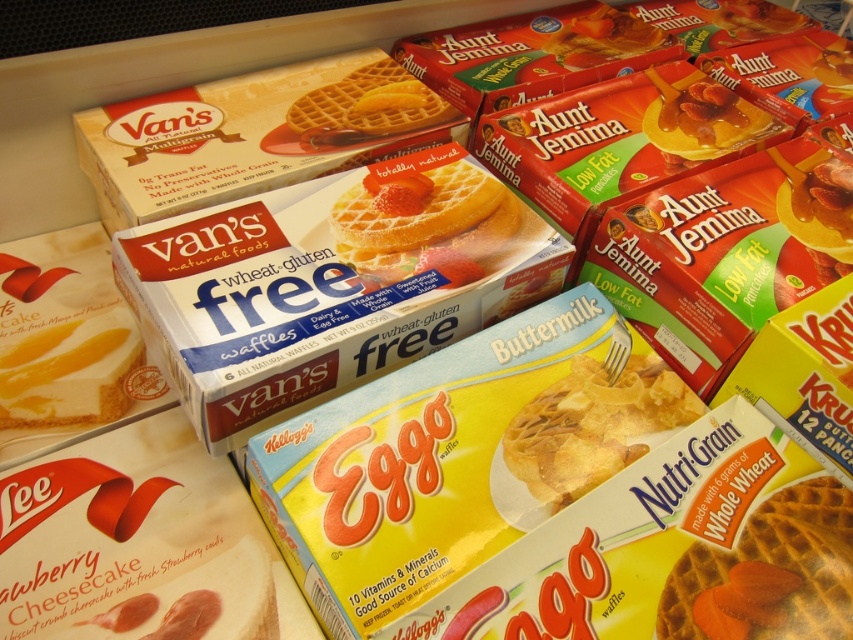
You are a customer in a grocery store looking at the breakfast section. You see the whole wheat waffle at center and the yellow matte waffle at center on the shelf. Which one is placed higher on the shelf?

The yellow matte waffle at center is placed higher on the shelf because the whole wheat waffle at center is positioned under it.

You are a customer looking at the breakfast items on the shelf. You want to pick up the whole wheat waffle at center and the yellow matte waffle at center. Which one should you grab first if you want to pick the one on the left first?

The whole wheat waffle at center is positioned on the right side of yellow matte waffle at center, so you should grab the yellow matte waffle at center first since it is on the left.